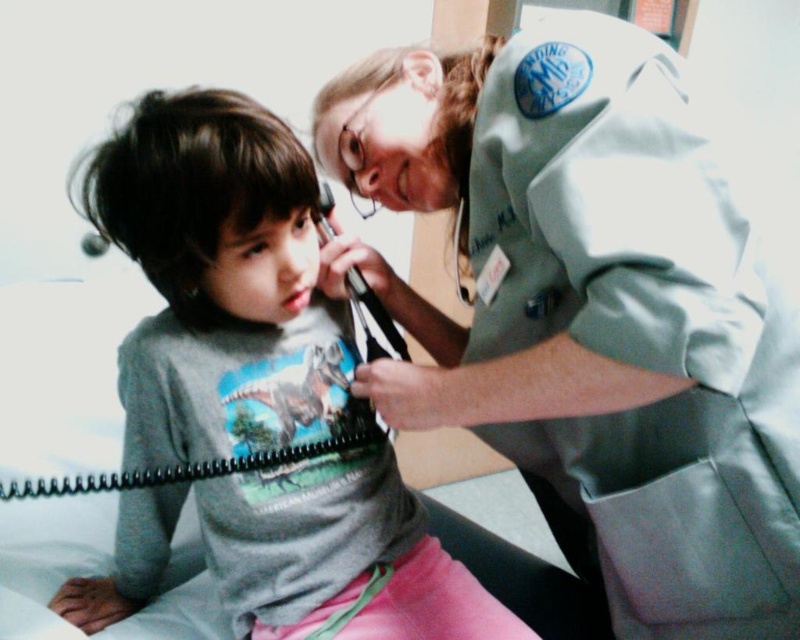
You are a medical student observing a healthcare professional in a clinical setting. You notice two gray items in the image. The first is the gray smooth uniform at upper right, and the second is the gray matte shirt at center. Which of these two gray items is positioned higher up in the image?

Result: The gray smooth uniform at upper right is much taller than the gray matte shirt at center, so it is positioned higher up in the image.

You are a medical student observing the examination. The healthcare professional is holding an otoscope. There are two points marked in the image. The first point is at coordinates point (600,385) and the second point is at coordinates point (166,256). Which point is closer to you?

Point (600,385) is closer to the viewer than point (166,256).

You are a medical student observing a healthcare professional and a child in a hospital room. You notice the gray smooth uniform at upper right and the gray matte shirt at center. Which object is positioned higher in the image?

The gray smooth uniform at upper right is located above the gray matte shirt at center in the image.